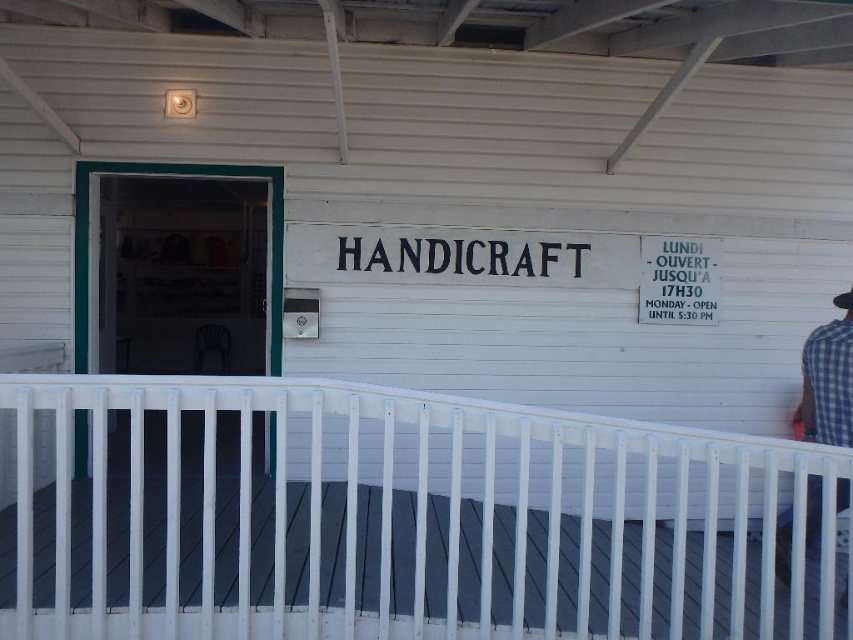
Question: Is white painted wood porch at lower center above blue checkered shirt at right?

Choices:
 (A) yes
 (B) no

Answer: (B)

Question: Which of the following is the farthest from the observer?

Choices:
 (A) (825, 410)
 (B) (195, 481)

Answer: (B)

Question: Does white painted wood porch at lower center lie behind blue checkered shirt at right?

Choices:
 (A) yes
 (B) no

Answer: (B)

Question: Which object appears closest to the camera in this image?

Choices:
 (A) white painted wood porch at lower center
 (B) blue checkered shirt at right

Answer: (A)

Question: Which point appears farthest from the camera in this image?

Choices:
 (A) (824, 355)
 (B) (376, 609)

Answer: (A)

Question: From the image, what is the correct spatial relationship of white painted wood porch at lower center in relation to blue checkered shirt at right?

Choices:
 (A) below
 (B) above

Answer: (A)